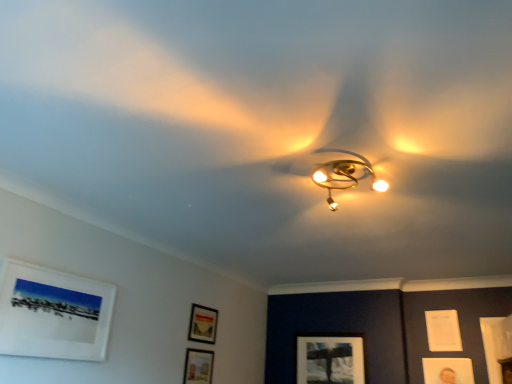
Question: Considering the positions of point (210, 379) and point (423, 365), is point (210, 379) closer or farther from the camera than point (423, 365)?

Choices:
 (A) closer
 (B) farther

Answer: (A)

Question: Considering the positions of matte black picture frame at lower center, acting as the fifth picture frame starting from the right, and matte gold picture frame at lower right, placed as the fifth picture frame when sorted from left to right, in the image, is matte black picture frame at lower center, acting as the fifth picture frame starting from the right, taller or shorter than matte gold picture frame at lower right, placed as the fifth picture frame when sorted from left to right,?

Choices:
 (A) short
 (B) tall

Answer: (B)

Question: Which of these objects is positioned closest to the matte white picture frame at lower center, which is the third picture frame from right to left?

Choices:
 (A) matte black picture frame at lower center, the 3th picture frame from the front
 (B) white matte picture frame at upper left, placed as the first picture frame when sorted from front to back
 (C) white paper at upper right, which is the sixth picture frame from left to right
 (D) gold metallic fan at center
 (E) gold metallic chandelier at center

Answer: (C)

Question: Which object is the farthest from the matte white picture frame at lower center, which is the 4th picture frame in left-to-right order?

Choices:
 (A) matte gold picture frame at lower right, the 3th picture frame when ordered from back to front
 (B) matte black picture frame at lower center, placed as the 2th picture frame when sorted from front to back
 (C) matte black picture frame at lower center, which is the fourth picture frame in right-to-left order
 (D) white matte picture frame at upper left, which is the 6th picture frame in back-to-front order
 (E) white paper at upper right, which appears as the fifth picture frame when viewed from the front

Answer: (D)